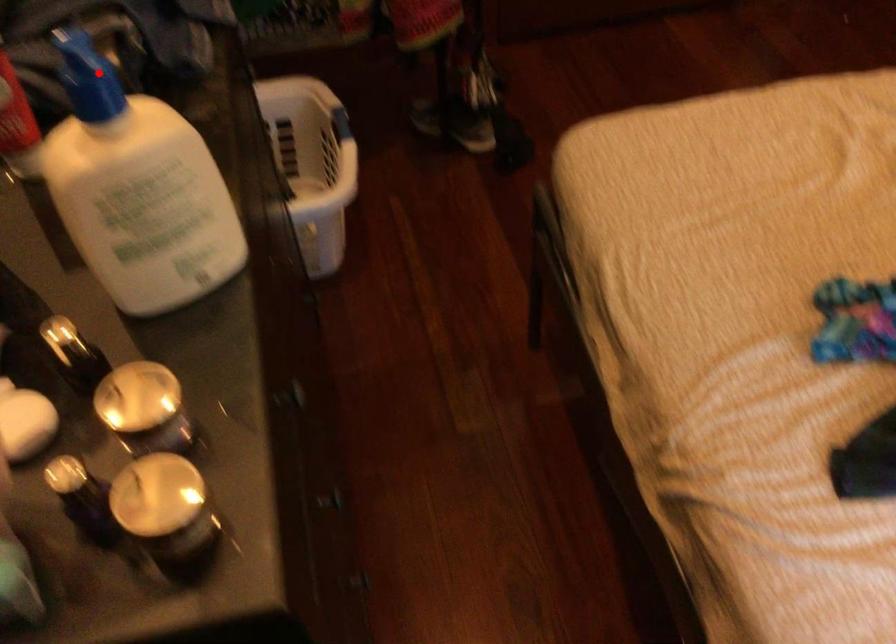
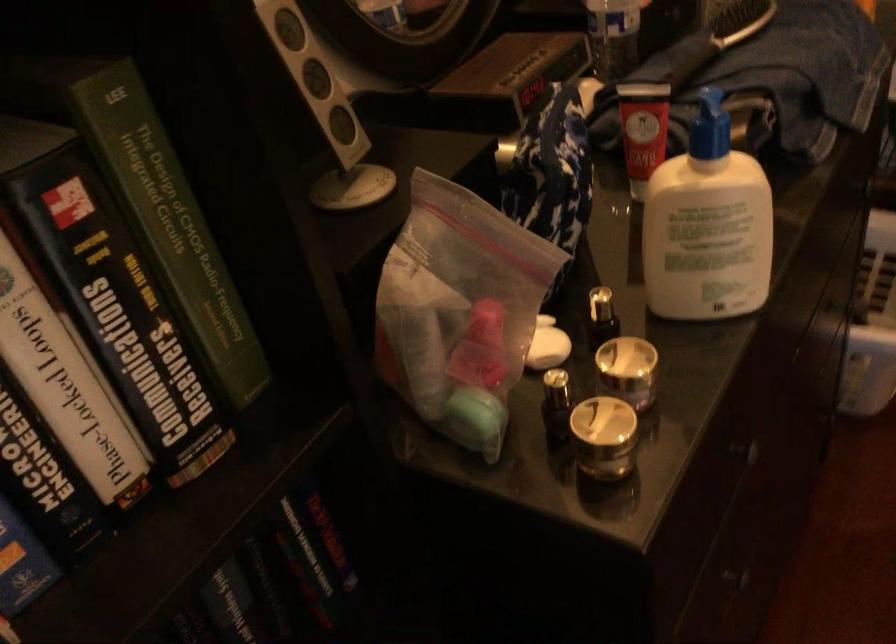
Question: I am providing you with two images of the same scene from different viewpoints. Image1 has a red point marked. In image2, the corresponding 3D location appears at what relative position? Reply with the corresponding letter.

Choices:
 (A) Closer
 (B) Farther

Answer: (B)